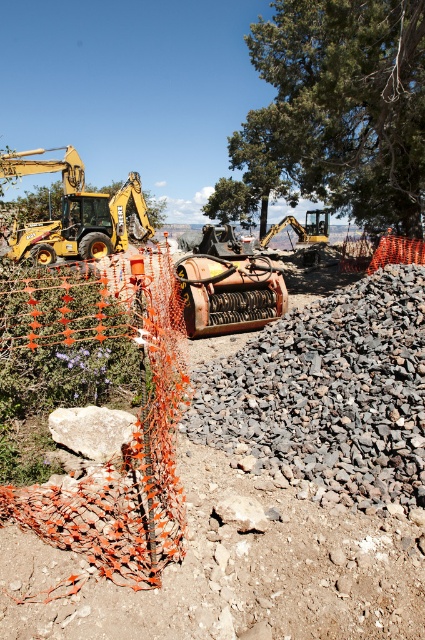
Question: Is orange mesh fence at center-left below yellow metal excavator at left?

Choices:
 (A) no
 (B) yes

Answer: (B)

Question: Based on their relative distances, which object is nearer to the yellow metal excavator at left?

Choices:
 (A) green leafy tree at upper center
 (B) green leafy tree at center

Answer: (B)

Question: Which object is the farthest from the orange mesh fence at center-left?

Choices:
 (A) green leafy tree at center
 (B) green leafy tree at upper center

Answer: (A)

Question: Is orange mesh fence at center-left further to camera compared to green leafy tree at center?

Choices:
 (A) no
 (B) yes

Answer: (A)

Question: Estimate the real-world distances between objects in this image. Which object is farther from the gray rough gravel at center?

Choices:
 (A) yellow metal excavator at left
 (B) yellow rubber excavator at upper left
 (C) orange mesh fence at center-left

Answer: (A)

Question: Does gray rough gravel at center have a lesser width compared to green leafy tree at upper center?

Choices:
 (A) yes
 (B) no

Answer: (A)